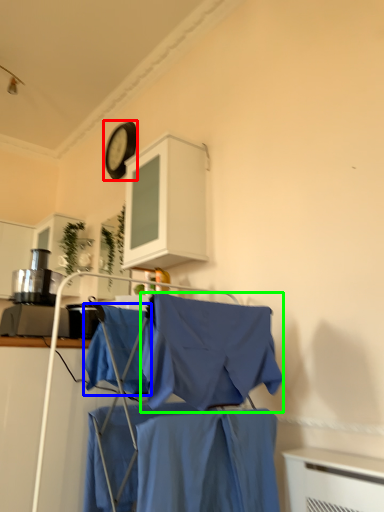
Question: Which object is positioned closest to clock (highlighted by a red box)? Select from fabric (highlighted by a blue box) and cloak (highlighted by a green box).

Choices:
 (A) fabric
 (B) cloak

Answer: (A)